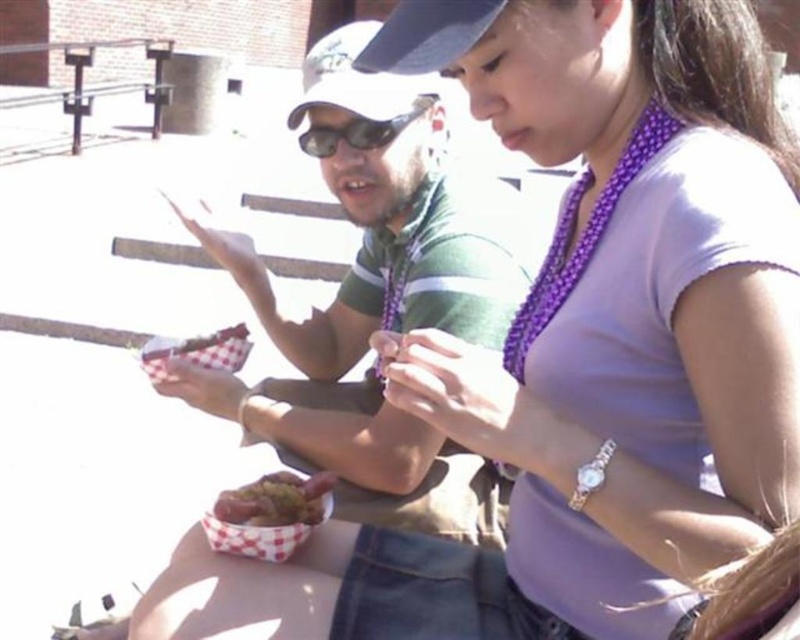
Question: Which of the following is the farthest from the observer?

Choices:
 (A) shiny metallic hot dog at center
 (B) sunglasses at center

Answer: (B)

Question: Is shiny metallic hot dog at center thinner than sunglasses at center?

Choices:
 (A) no
 (B) yes

Answer: (B)

Question: Can you confirm if shiny metallic hot dog at center is positioned to the right of sunglasses at center?

Choices:
 (A) yes
 (B) no

Answer: (B)

Question: Is shiny metallic hot dog at center thinner than sunglasses at center?

Choices:
 (A) no
 (B) yes

Answer: (B)